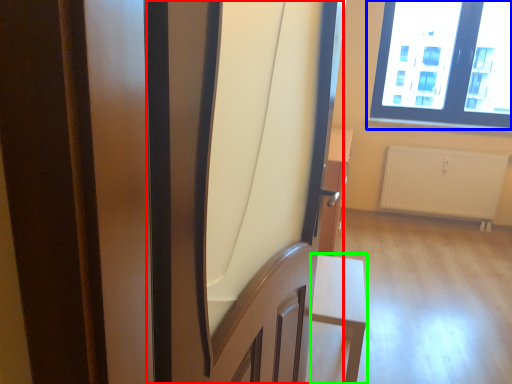
Question: Estimate the real-world distances between objects in this image. Which object is farther from screen door (highlighted by a red box), window (highlighted by a blue box) or furniture (highlighted by a green box)?

Choices:
 (A) window
 (B) furniture

Answer: (A)